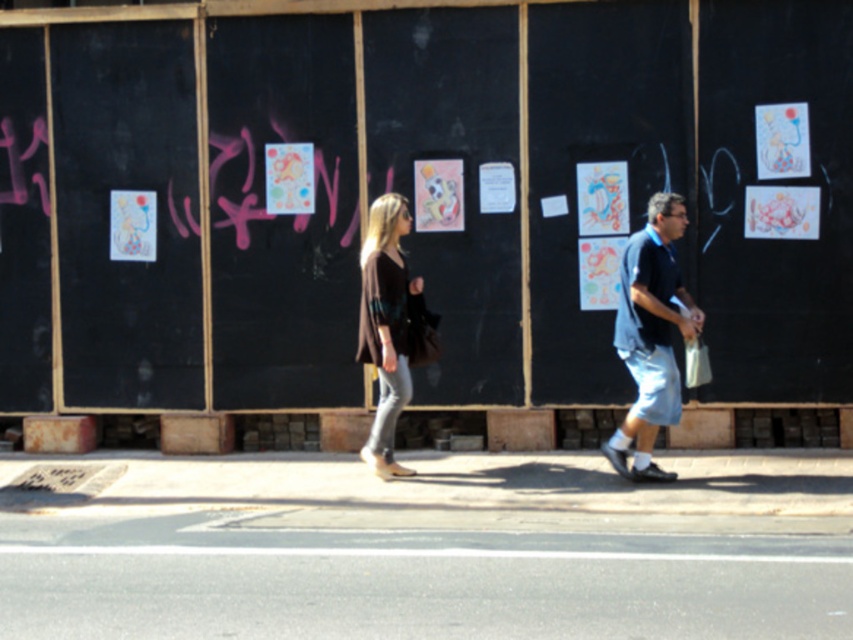
You are an artist who wants to hang a new poster on the black matte bulletin board at center. However, you notice the brown textured sweater at center is already occupying space there. Can you still fit your poster on the bulletin board without removing the sweater?

The black matte bulletin board at center is smaller than the brown textured sweater at center, so it might not have enough space to accommodate the new poster alongside the sweater.